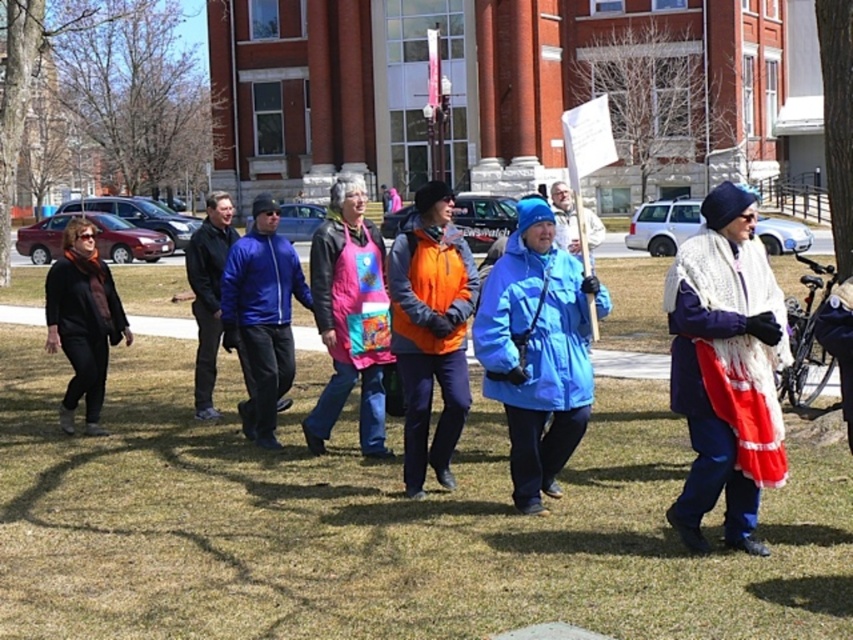
Does blue smooth jacket at center come in front of black leather jacket at center?

Yes.

Does blue smooth jacket at center appear over black leather jacket at center?

Correct, blue smooth jacket at center is located above black leather jacket at center.

The image size is (853, 640). In order to click on blue smooth jacket at center in this screenshot , I will do `click(262, 316)`.

Which is behind, point (408, 397) or point (252, 404)?

Positioned behind is point (252, 404).

Does orange fleece jacket at center have a greater height compared to blue smooth jacket at center?

In fact, orange fleece jacket at center may be shorter than blue smooth jacket at center.

Where is `orange fleece jacket at center`? The width and height of the screenshot is (853, 640). orange fleece jacket at center is located at coordinates (431, 330).

Image resolution: width=853 pixels, height=640 pixels. I want to click on orange fleece jacket at center, so click(x=431, y=330).

Which is above, green grass at center or matte black jacket at left?

matte black jacket at left

Can you confirm if green grass at center is positioned to the left of matte black jacket at left?

In fact, green grass at center is to the right of matte black jacket at left.

Which is behind, point (219, 545) or point (76, 388)?

The point (76, 388) is behind.

The height and width of the screenshot is (640, 853). I want to click on green grass at center, so click(380, 524).